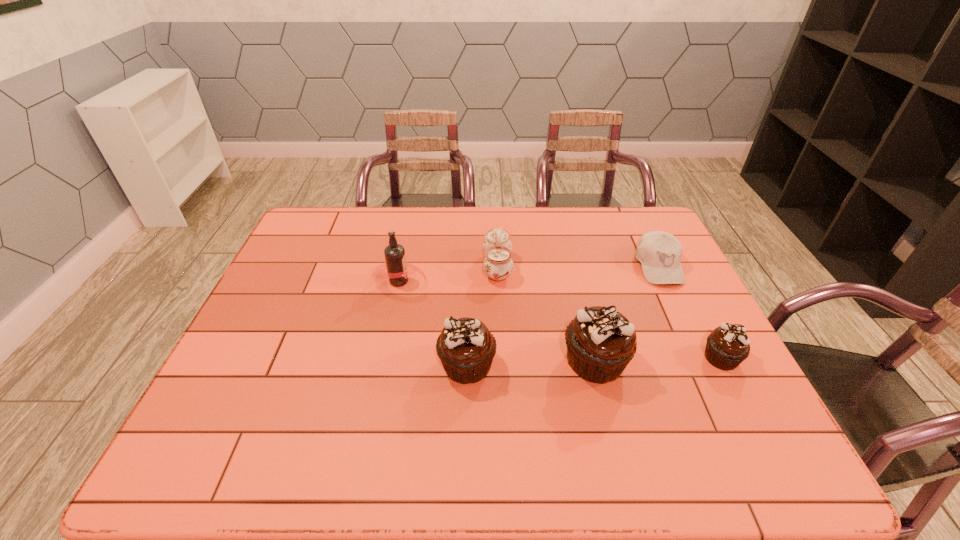
Find the location of a particular element. the second tallest cupcake is located at coordinates (466, 348).

The height and width of the screenshot is (540, 960). Identify the location of the second cupcake from right to left. (601, 342).

I want to click on the rightmost cupcake, so click(728, 345).

At what (x,y) coordinates should I click in order to perform the action: click on chinaware. Please return your answer as a coordinate pair (x, y). This screenshot has width=960, height=540. Looking at the image, I should click on (497, 247).

Locate an element on the screen. The height and width of the screenshot is (540, 960). baseball cap is located at coordinates (660, 253).

At what (x,y) coordinates should I click in order to perform the action: click on the leftmost object. Please return your answer as a coordinate pair (x, y). This screenshot has height=540, width=960. Looking at the image, I should click on (395, 258).

Image resolution: width=960 pixels, height=540 pixels. What are the coordinates of `free space located 0.110m on the back of the leftmost cupcake` in the screenshot? It's located at (468, 312).

The height and width of the screenshot is (540, 960). I want to click on vacant space located on the left of the second cupcake from left to right, so click(460, 361).

Locate an element on the screen. free location located on the front of the shortest cupcake is located at coordinates (742, 399).

Find the location of a particular element. free location located 0.060m by the handle of the chinaware is located at coordinates (464, 267).